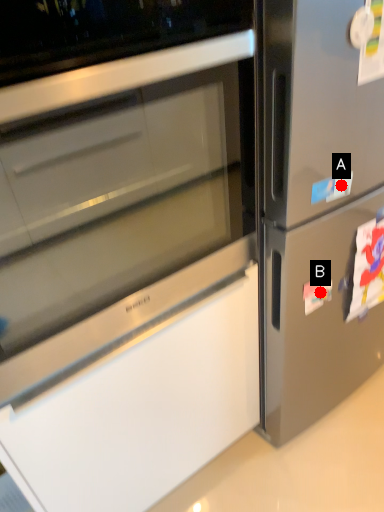
Question: Two points are circled on the image, labeled by A and B beside each circle. Which of the following is the closest to the observer?

Choices:
 (A) A is closer
 (B) B is closer

Answer: (A)